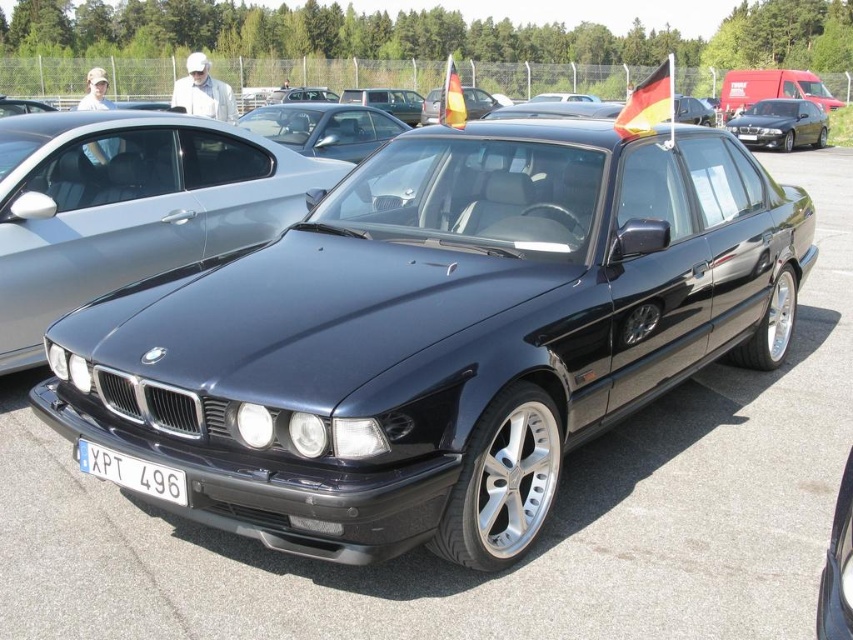
You are a photographer standing in front of the satin black car at center and the white plastic license plate at lower center. Which object is closer to you?

The satin black car at center is closer to you than the white plastic license plate at lower center because it is positioned further to the viewer.

You are a photographer standing at the exhibition area. You want to take a photo of the satin black sedan at center from a distance that allows you to capture the entire car without any distortion. Considering the camera you have has a maximum focal length of 50mm, which is ideal for capturing full body shots at distances between 2 to 3 meters. Is your current distance sufficient to take the photo without distortion?

The satin black sedan at center and viewer are 2.49 meters apart. Since the ideal distance is between 2 to 3 meters, the current distance of 2.49 meters is within the recommended range. Therefore, the photographer can take the photo without distortion.

You are a photographer trying to capture the shiny black sedan at center and the white plastic license plate at lower center in the same frame. Since you want to emphasize the car, which object should you focus on first and why?

You should focus on the shiny black sedan at center first because its width is larger than the white plastic license plate at lower center, making it the dominant object in the frame.